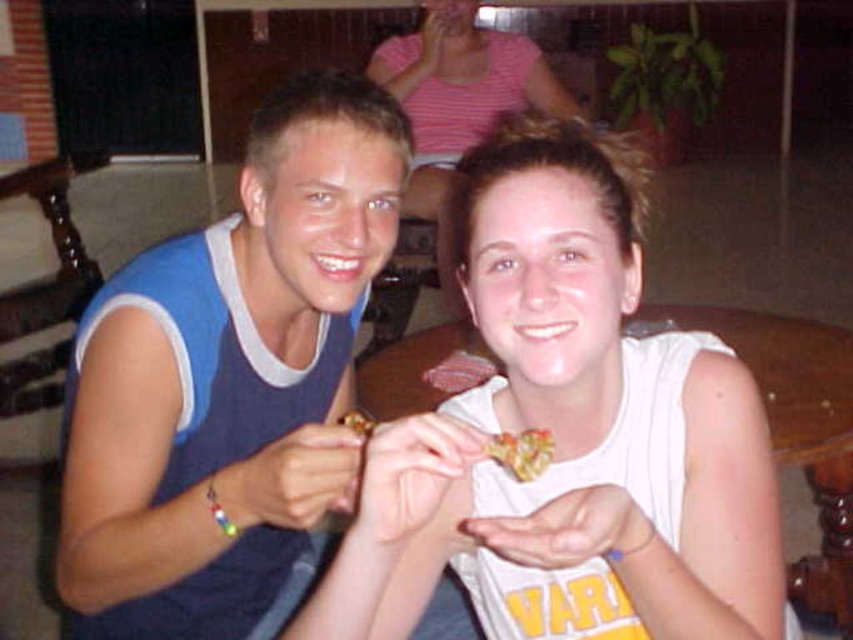
Which is more to the right, smooth white tank top at center or shiny metallic snack at center?

From the viewer's perspective, smooth white tank top at center appears more on the right side.

Does smooth white tank top at center appear under shiny metallic snack at center?

Incorrect, smooth white tank top at center is not positioned below shiny metallic snack at center.

Is point (433, 49) closer to camera compared to point (502, 433)?

No, it is not.

Where is `smooth white tank top at center`? smooth white tank top at center is located at coordinates (457, 104).

Is white matte food at center shorter than smooth white tank top at center?

Yes.

Does white matte food at center have a smaller size compared to smooth white tank top at center?

Yes, white matte food at center is smaller than smooth white tank top at center.

Where is `white matte food at center`? white matte food at center is located at coordinates (567, 436).

Who is higher up, white matte food at center or shiny metallic snack at center?

white matte food at center is above.

Identify the location of white matte food at center. This screenshot has height=640, width=853. (567, 436).

Describe the element at coordinates (567, 436) in the screenshot. I see `white matte food at center` at that location.

You are a GUI agent. You are given a task and a screenshot of the screen. Output one action in this format:
    pyautogui.click(x=<x>, y=<y>)
    Task: Click on the white matte food at center
    The image size is (853, 640).
    Given the screenshot: What is the action you would take?
    [x=567, y=436]